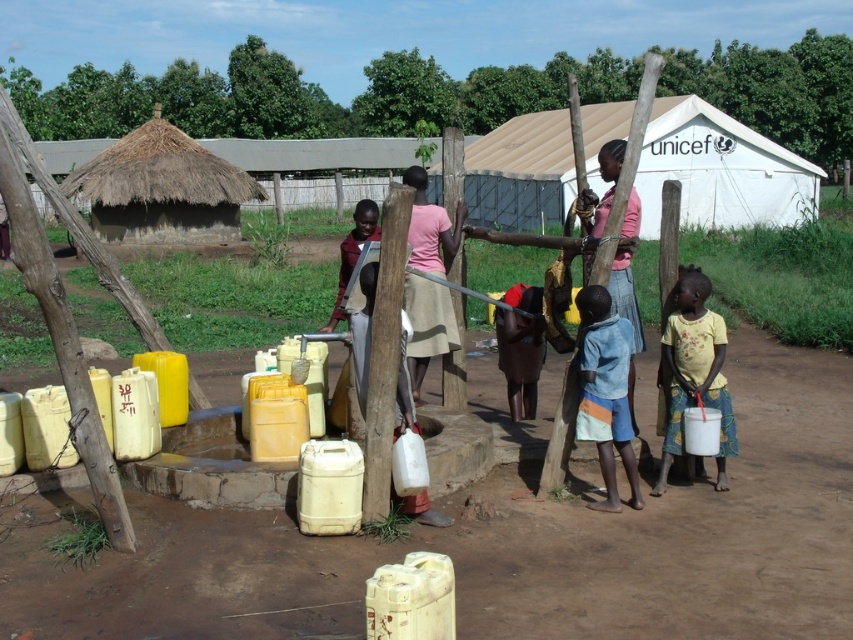
You are standing at the well and see the white canvas tent at upper center and the pink matte skirt at center. Which object is located to the right of the other?

The white canvas tent at upper center is positioned on the right side of pink matte skirt at center.